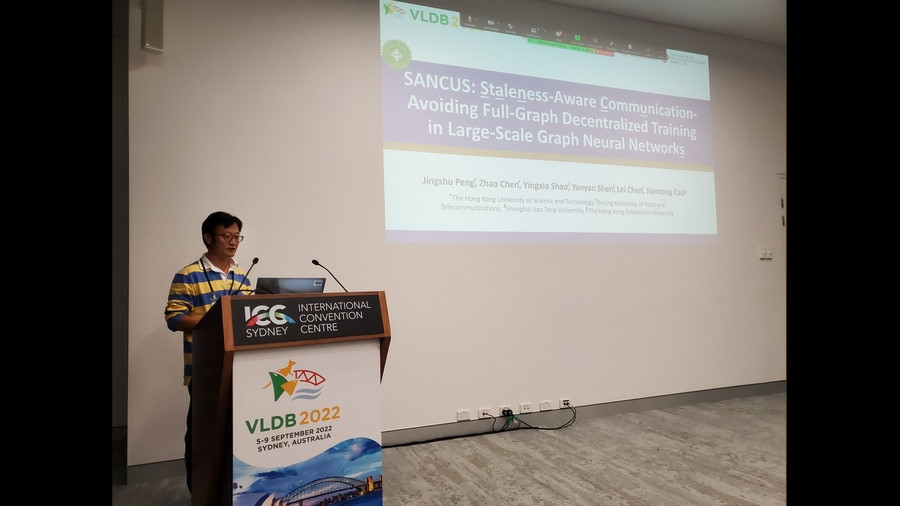
I want to click on poster, so click(352, 390).